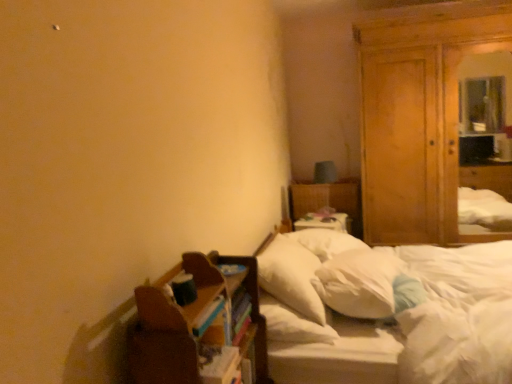
Question: From the image's perspective, is white fabric bed at center below brown wooden shelf at lower left?

Choices:
 (A) yes
 (B) no

Answer: (B)

Question: Is white fabric bed at center oriented away from brown wooden shelf at lower left?

Choices:
 (A) no
 (B) yes

Answer: (A)

Question: From a real-world perspective, does white fabric bed at center stand above brown wooden shelf at lower left?

Choices:
 (A) yes
 (B) no

Answer: (B)

Question: Considering the relative sizes of white fabric bed at center and brown wooden shelf at lower left in the image provided, is white fabric bed at center smaller than brown wooden shelf at lower left?

Choices:
 (A) no
 (B) yes

Answer: (A)

Question: From a real-world perspective, is white fabric bed at center positioned under brown wooden shelf at lower left based on gravity?

Choices:
 (A) yes
 (B) no

Answer: (A)

Question: From the image's perspective, is white soft mattress at center above or below wooden wardrobe at right?

Choices:
 (A) below
 (B) above

Answer: (A)

Question: Would you say white soft mattress at center is to the left or to the right of wooden wardrobe at right in the picture?

Choices:
 (A) right
 (B) left

Answer: (B)

Question: From their relative heights in the image, would you say white soft mattress at center is taller or shorter than wooden wardrobe at right?

Choices:
 (A) tall
 (B) short

Answer: (B)

Question: Would you say white soft mattress at center is inside or outside wooden wardrobe at right?

Choices:
 (A) outside
 (B) inside

Answer: (A)

Question: From the image's perspective, is white soft pillow at center, which is the first pillow from left to right, positioned above or below white soft pillow at center, the 2th pillow viewed from the left?

Choices:
 (A) above
 (B) below

Answer: (A)

Question: In the image, is white soft pillow at center, which ranks as the second pillow in right-to-left order, positioned in front of or behind white soft pillow at center, arranged as the 1th pillow when viewed from the right?

Choices:
 (A) behind
 (B) front

Answer: (A)

Question: Is white soft pillow at center, which is the first pillow from left to right, wider or thinner than white soft pillow at center, the 2th pillow viewed from the left?

Choices:
 (A) thin
 (B) wide

Answer: (A)

Question: In terms of height, does white soft pillow at center, which ranks as the second pillow in right-to-left order, look taller or shorter compared to white soft pillow at center, arranged as the 1th pillow when viewed from the right?

Choices:
 (A) tall
 (B) short

Answer: (A)

Question: Is white fabric bed at center spatially inside wooden wardrobe at right, or outside of it?

Choices:
 (A) inside
 (B) outside

Answer: (B)

Question: From the image's perspective, is white fabric bed at center located above or below wooden wardrobe at right?

Choices:
 (A) below
 (B) above

Answer: (A)